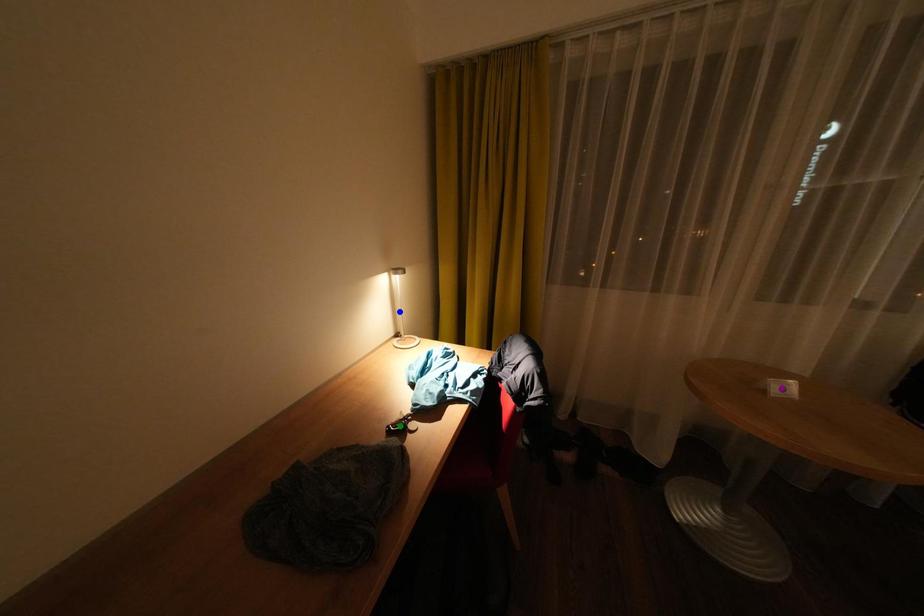
Order these from nearest to farthest:
blue point | green point | purple point

blue point, purple point, green point